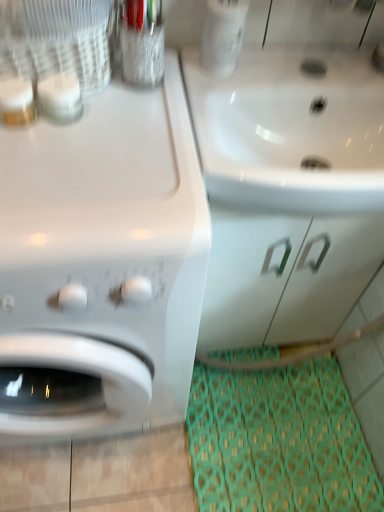
Question: From the image's perspective, is white glossy drawer at center over white glossy washing machine at left?

Choices:
 (A) yes
 (B) no

Answer: (B)

Question: Can you confirm if white glossy drawer at center is thinner than white glossy washing machine at left?

Choices:
 (A) no
 (B) yes

Answer: (B)

Question: Considering the relative positions of white glossy drawer at center and white glossy washing machine at left in the image provided, is white glossy drawer at center to the right of white glossy washing machine at left from the viewer's perspective?

Choices:
 (A) yes
 (B) no

Answer: (A)

Question: Does white glossy drawer at center appear on the left side of white glossy washing machine at left?

Choices:
 (A) no
 (B) yes

Answer: (A)

Question: Considering the relative sizes of white glossy drawer at center and white glossy washing machine at left in the image provided, is white glossy drawer at center wider than white glossy washing machine at left?

Choices:
 (A) yes
 (B) no

Answer: (B)

Question: From the image's perspective, is white glossy washing machine at left positioned above or below white glossy sink at upper right?

Choices:
 (A) above
 (B) below

Answer: (B)

Question: In the image, is white glossy washing machine at left positioned in front of or behind white glossy sink at upper right?

Choices:
 (A) front
 (B) behind

Answer: (A)

Question: From a real-world perspective, is white glossy washing machine at left positioned above or below white glossy sink at upper right?

Choices:
 (A) below
 (B) above

Answer: (A)

Question: Is white glossy washing machine at left wider or thinner than white glossy sink at upper right?

Choices:
 (A) wide
 (B) thin

Answer: (A)

Question: Considering the positions of white glossy drawer at center and green fabric doormat at lower right in the image, is white glossy drawer at center taller or shorter than green fabric doormat at lower right?

Choices:
 (A) short
 (B) tall

Answer: (B)

Question: Is white glossy drawer at center spatially inside green fabric doormat at lower right, or outside of it?

Choices:
 (A) outside
 (B) inside

Answer: (A)

Question: Considering the positions of white glossy drawer at center and green fabric doormat at lower right in the image, is white glossy drawer at center wider or thinner than green fabric doormat at lower right?

Choices:
 (A) thin
 (B) wide

Answer: (A)

Question: In the image, is white glossy drawer at center positioned in front of or behind green fabric doormat at lower right?

Choices:
 (A) front
 (B) behind

Answer: (A)

Question: From a real-world perspective, is green fabric doormat at lower right positioned above or below white glossy washing machine at left?

Choices:
 (A) below
 (B) above

Answer: (A)

Question: Is green fabric doormat at lower right to the left or to the right of white glossy washing machine at left in the image?

Choices:
 (A) right
 (B) left

Answer: (A)